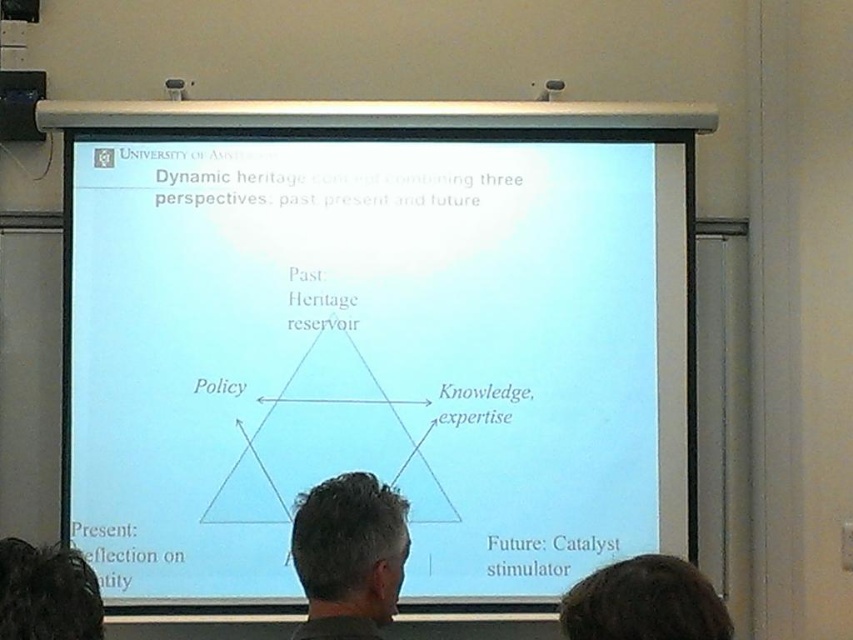
Which is more to the left, white paper at center or gray hair at center?

Positioned to the left is gray hair at center.

Who is taller, white paper at center or gray hair at center?

Standing taller between the two is white paper at center.

Who is more distant from viewer, [158,156] or [325,630]?

Point [158,156]

What are the coordinates of `white paper at center` in the screenshot? It's located at (373, 355).

Is the position of white paper at center less distant than that of dark brown hair at upper center?

No, it is behind dark brown hair at upper center.

Which is behind, point (123, 176) or point (648, 614)?

Positioned behind is point (123, 176).

The width and height of the screenshot is (853, 640). I want to click on white paper at center, so click(x=373, y=355).

In order to click on white paper at center in this screenshot , I will do `click(373, 355)`.

Can you confirm if gray hair at center is bigger than dark brown hair at upper center?

Indeed, gray hair at center has a larger size compared to dark brown hair at upper center.

In the scene shown: Who is more distant from viewer, (358,484) or (659,577)?

Positioned behind is point (358,484).

Identify the location of gray hair at center. (349, 556).